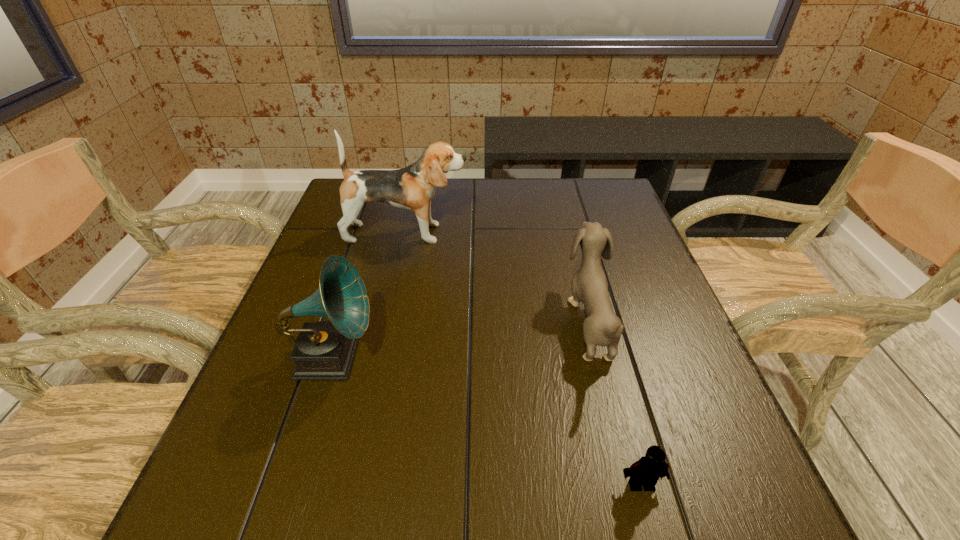
The width and height of the screenshot is (960, 540). I want to click on vacant space in between the phonograph_record and the nearest object, so click(x=487, y=421).

Where is `free area in between the Lego and the tallest object`? Image resolution: width=960 pixels, height=540 pixels. free area in between the Lego and the tallest object is located at coordinates (523, 359).

Identify the location of free space between the Lego and the phonograph_record. (487, 421).

Locate an element on the screen. This screenshot has height=540, width=960. free space between the nearer puppy and the phonograph_record is located at coordinates (461, 340).

Where is `object that is the nearest to the farthest object`? This screenshot has height=540, width=960. object that is the nearest to the farthest object is located at coordinates (602, 327).

Locate an element on the screen. The image size is (960, 540). object that ranks as the second closest to the shortest object is located at coordinates (x=324, y=350).